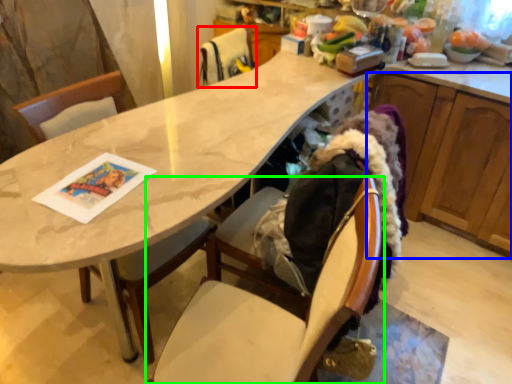
Question: Considering the real-world distances, which object is closest to chair (highlighted by a red box)? cabinetry (highlighted by a blue box) or chair (highlighted by a green box).

Choices:
 (A) cabinetry
 (B) chair

Answer: (A)